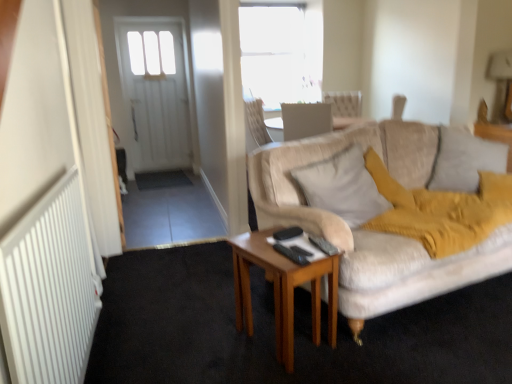
In order to click on wooden table at center in this screenshot , I will do `click(282, 290)`.

Measure the distance between point [286,250] and camera.

The distance of point [286,250] from camera is 1.85 meters.

Locate an element on the screen. black plastic remote control at center, which is the 1th remote control from front to back is located at coordinates (291, 254).

I want to click on black plastic remote control at center, the 2th remote control in the back-to-front sequence, so click(x=324, y=245).

What do you see at coordinates (288, 233) in the screenshot? Image resolution: width=512 pixels, height=384 pixels. I see `black plastic remote control at center, which ranks as the third remote control in front-to-back order` at bounding box center [288, 233].

You are a GUI agent. You are given a task and a screenshot of the screen. Output one action in this format:
    pyautogui.click(x=<x>, y=<y>)
    Task: Click on the wooden table at center
    The image size is (512, 384).
    Given the screenshot: What is the action you would take?
    pyautogui.click(x=282, y=290)

Is black plastic remote control at center, which is counted as the 2th remote control, starting from the front, oriented away from black plastic remote control at center, which is the 1th remote control from front to back?

No, black plastic remote control at center, which is counted as the 2th remote control, starting from the front,'s orientation is not away from black plastic remote control at center, which is the 1th remote control from front to back.

Is black plastic remote control at center, the 2th remote control in the back-to-front sequence, at the right side of black plastic remote control at center, which appears as the 3th remote control when viewed from the back?

Correct, you'll find black plastic remote control at center, the 2th remote control in the back-to-front sequence, to the right of black plastic remote control at center, which appears as the 3th remote control when viewed from the back.

Are black plastic remote control at center, the 2th remote control in the back-to-front sequence, and black plastic remote control at center, which is the 1th remote control from front to back, far apart?

black plastic remote control at center, the 2th remote control in the back-to-front sequence, is actually quite close to black plastic remote control at center, which is the 1th remote control from front to back.

Is black plastic remote control at center, the 2th remote control in the back-to-front sequence, smaller than black plastic remote control at center, which is the 1th remote control from front to back?

No, black plastic remote control at center, the 2th remote control in the back-to-front sequence, is not smaller than black plastic remote control at center, which is the 1th remote control from front to back.

From a real-world perspective, is light beige fabric pillow at center, arranged as the 1th pillow when viewed from the left, below black plastic remote control at center, which is the 1th remote control from front to back?

No, from a real-world perspective, light beige fabric pillow at center, arranged as the 1th pillow when viewed from the left, is not under black plastic remote control at center, which is the 1th remote control from front to back.

In the scene shown: Is light beige fabric pillow at center, arranged as the 1th pillow when viewed from the left, positioned in front of black plastic remote control at center, which is the 1th remote control from front to back?

No, light beige fabric pillow at center, arranged as the 1th pillow when viewed from the left, is further to the viewer.

Is point (308, 168) positioned before point (278, 243)?

No, (308, 168) is further to viewer.

Is light beige fabric pillow at center, arranged as the 1th pillow when viewed from the left, wider than black plastic remote control at center, which is the 1th remote control from front to back?

Indeed, light beige fabric pillow at center, arranged as the 1th pillow when viewed from the left, has a greater width compared to black plastic remote control at center, which is the 1th remote control from front to back.

Could you tell me if black plastic remote control at center, which appears as the 3th remote control when viewed from the back, is turned towards soft beige pillow at right, which appears as the 1th pillow when viewed from the right?

No.

Looking at this image, how different are the orientations of black plastic remote control at center, which is the 1th remote control from front to back, and soft beige pillow at right, marked as the 2th pillow in a left-to-right arrangement, in degrees?

black plastic remote control at center, which is the 1th remote control from front to back, and soft beige pillow at right, marked as the 2th pillow in a left-to-right arrangement, are facing 55.2 degrees away from each other.

From the image's perspective, is black plastic remote control at center, which appears as the 3th remote control when viewed from the back, positioned above or below soft beige pillow at right, marked as the 2th pillow in a left-to-right arrangement?

black plastic remote control at center, which appears as the 3th remote control when viewed from the back, is situated lower than soft beige pillow at right, marked as the 2th pillow in a left-to-right arrangement, in the image.

Looking at this image, is black plastic remote control at center, which appears as the 3th remote control when viewed from the back, to the left or to the right of soft beige pillow at right, which appears as the 1th pillow when viewed from the right, in the image?

black plastic remote control at center, which appears as the 3th remote control when viewed from the back, is positioned on soft beige pillow at right, which appears as the 1th pillow when viewed from the right,'s left side.

Which is behind, point (342, 185) or point (274, 237)?

Point (342, 185)

Considering the positions of objects light beige fabric pillow at center, which is the second pillow from right to left, and black plastic remote control at center, which is counted as the first remote control, starting from the back, in the image provided, who is in front, light beige fabric pillow at center, which is the second pillow from right to left, or black plastic remote control at center, which is counted as the first remote control, starting from the back,?

black plastic remote control at center, which is counted as the first remote control, starting from the back, is closer to the camera.

What's the angular difference between light beige fabric pillow at center, arranged as the 1th pillow when viewed from the left, and black plastic remote control at center, which is counted as the first remote control, starting from the back,'s facing directions?

light beige fabric pillow at center, arranged as the 1th pillow when viewed from the left, and black plastic remote control at center, which is counted as the first remote control, starting from the back, are facing 2.46 degrees away from each other.

From a real-world perspective, is light beige fabric pillow at center, arranged as the 1th pillow when viewed from the left, beneath black plastic remote control at center, which is counted as the first remote control, starting from the back?

No, from a real-world perspective, light beige fabric pillow at center, arranged as the 1th pillow when viewed from the left, is not below black plastic remote control at center, which is counted as the first remote control, starting from the back.

Are light beige fabric pillow at center, arranged as the 1th pillow when viewed from the left, and metallic gold lampshade at upper right making contact?

No, light beige fabric pillow at center, arranged as the 1th pillow when viewed from the left, is not touching metallic gold lampshade at upper right.

Considering the points (295, 169) and (496, 98), which point is behind, point (295, 169) or point (496, 98)?

The point (496, 98) is behind.

Consider the image. Could you tell me if light beige fabric pillow at center, arranged as the 1th pillow when viewed from the left, is turned towards metallic gold lampshade at upper right?

No, light beige fabric pillow at center, arranged as the 1th pillow when viewed from the left, is not facing towards metallic gold lampshade at upper right.

This screenshot has width=512, height=384. What are the coordinates of `lamp behind the light beige fabric pillow at center, arranged as the 1th pillow when viewed from the left` in the screenshot? It's located at (500, 82).

Considering the positions of points (313, 177) and (324, 240), is point (313, 177) farther from camera compared to point (324, 240)?

Yes, point (313, 177) is farther from viewer.

Visually, is light beige fabric pillow at center, which is the second pillow from right to left, positioned to the left or to the right of black plastic remote control at center, the 2th remote control in the back-to-front sequence?

Based on their positions, light beige fabric pillow at center, which is the second pillow from right to left, is located to the right of black plastic remote control at center, the 2th remote control in the back-to-front sequence.

Does light beige fabric pillow at center, which is the second pillow from right to left, have a greater width compared to black plastic remote control at center, the 2th remote control in the back-to-front sequence?

Yes.

Is black plastic remote control at center, the 2th remote control in the back-to-front sequence, at the back of light beige fabric pillow at center, which is the second pillow from right to left?

No, light beige fabric pillow at center, which is the second pillow from right to left, is not facing away from black plastic remote control at center, the 2th remote control in the back-to-front sequence.

From a real-world perspective, between soft beige pillow at right, which appears as the 1th pillow when viewed from the right, and black plastic remote control at center, the 2th remote control in the back-to-front sequence, who is vertically higher?

soft beige pillow at right, which appears as the 1th pillow when viewed from the right, from a real-world perspective.

Which pillow is the 2nd one when counting from the back of the black plastic remote control at center, which is counted as the 2th remote control, starting from the front? Please provide its 2D coordinates.

[(465, 160)]

Is soft beige pillow at right, which appears as the 1th pillow when viewed from the right, not close to black plastic remote control at center, which is counted as the 2th remote control, starting from the front?

Yes, soft beige pillow at right, which appears as the 1th pillow when viewed from the right, and black plastic remote control at center, which is counted as the 2th remote control, starting from the front, are located far from each other.

Is soft beige pillow at right, which appears as the 1th pillow when viewed from the right, smaller than black plastic remote control at center, which is counted as the 2th remote control, starting from the front?

No, soft beige pillow at right, which appears as the 1th pillow when viewed from the right, is not smaller than black plastic remote control at center, which is counted as the 2th remote control, starting from the front.

You are a GUI agent. You are given a task and a screenshot of the screen. Output one action in this format:
    pyautogui.click(x=<x>, y=<y>)
    Task: Click on the 1st remote control behind when counting from the black plastic remote control at center, which is the 1th remote control from front to back
    The width and height of the screenshot is (512, 384).
    Given the screenshot: What is the action you would take?
    pyautogui.click(x=324, y=245)

Where is `the 3rd remote control directly beneath the light beige fabric pillow at center, arranged as the 1th pillow when viewed from the left (from a real-world perspective)`? the 3rd remote control directly beneath the light beige fabric pillow at center, arranged as the 1th pillow when viewed from the left (from a real-world perspective) is located at coordinates (291, 254).

From the image, which object appears to be nearer to soft beige pillow at right, which appears as the 1th pillow when viewed from the right, black plastic remote control at center, which is the 1th remote control from front to back, or metallic gold lampshade at upper right?

Based on the image, metallic gold lampshade at upper right appears to be nearer to soft beige pillow at right, which appears as the 1th pillow when viewed from the right.

When comparing their distances from black plastic remote control at center, the 2th remote control in the back-to-front sequence, does black plastic remote control at center, which ranks as the third remote control in front-to-back order, or wooden table at center seem closer?

The object closer to black plastic remote control at center, the 2th remote control in the back-to-front sequence, is black plastic remote control at center, which ranks as the third remote control in front-to-back order.

Looking at the image, which one is located further to wooden table at center, soft beige pillow at right, which appears as the 1th pillow when viewed from the right, or light beige fabric pillow at center, which is the second pillow from right to left?

The object further to wooden table at center is soft beige pillow at right, which appears as the 1th pillow when viewed from the right.

Considering their positions, is black plastic remote control at center, which is counted as the 2th remote control, starting from the front, positioned further to metallic gold lampshade at upper right than light beige fabric pillow at center, arranged as the 1th pillow when viewed from the left?

Among the two, black plastic remote control at center, which is counted as the 2th remote control, starting from the front, is located further to metallic gold lampshade at upper right.

Looking at the image, which one is located further to soft beige pillow at right, marked as the 2th pillow in a left-to-right arrangement, metallic gold lampshade at upper right or wooden table at center?

Among the two, wooden table at center is located further to soft beige pillow at right, marked as the 2th pillow in a left-to-right arrangement.

Which object lies nearer to the anchor point black plastic remote control at center, which is counted as the first remote control, starting from the back, wooden table at center or soft beige pillow at right, which appears as the 1th pillow when viewed from the right?

wooden table at center is closer to black plastic remote control at center, which is counted as the first remote control, starting from the back.

From the image, which object appears to be farther from light beige fabric pillow at center, arranged as the 1th pillow when viewed from the left, black plastic remote control at center, which is counted as the 2th remote control, starting from the front, or black plastic remote control at center, which appears as the 3th remote control when viewed from the back?

The object further to light beige fabric pillow at center, arranged as the 1th pillow when viewed from the left, is black plastic remote control at center, which appears as the 3th remote control when viewed from the back.

Looking at the image, which one is located closer to light beige fabric pillow at center, which is the second pillow from right to left, black plastic remote control at center, which appears as the 3th remote control when viewed from the back, or black plastic remote control at center, which is counted as the 2th remote control, starting from the front?

black plastic remote control at center, which is counted as the 2th remote control, starting from the front, is positioned closer to the anchor light beige fabric pillow at center, which is the second pillow from right to left.

The width and height of the screenshot is (512, 384). Find the location of `remote control between black plastic remote control at center, which appears as the 3th remote control when viewed from the back, and soft beige pillow at right, which appears as the 1th pillow when viewed from the right, from left to right`. remote control between black plastic remote control at center, which appears as the 3th remote control when viewed from the back, and soft beige pillow at right, which appears as the 1th pillow when viewed from the right, from left to right is located at coordinates (324, 245).

Identify the location of remote control located between black plastic remote control at center, which appears as the 3th remote control when viewed from the back, and light beige fabric pillow at center, which is the second pillow from right to left, in the left-right direction. Image resolution: width=512 pixels, height=384 pixels. (x=324, y=245).

Where is `remote control located between black plastic remote control at center, which is the 1th remote control from front to back, and black plastic remote control at center, which ranks as the third remote control in front-to-back order, in the depth direction`? The height and width of the screenshot is (384, 512). remote control located between black plastic remote control at center, which is the 1th remote control from front to back, and black plastic remote control at center, which ranks as the third remote control in front-to-back order, in the depth direction is located at coordinates (324, 245).

The width and height of the screenshot is (512, 384). What are the coordinates of `remote control between black plastic remote control at center, which is counted as the 2th remote control, starting from the front, and wooden table at center in the up-down direction` in the screenshot? It's located at (291, 254).